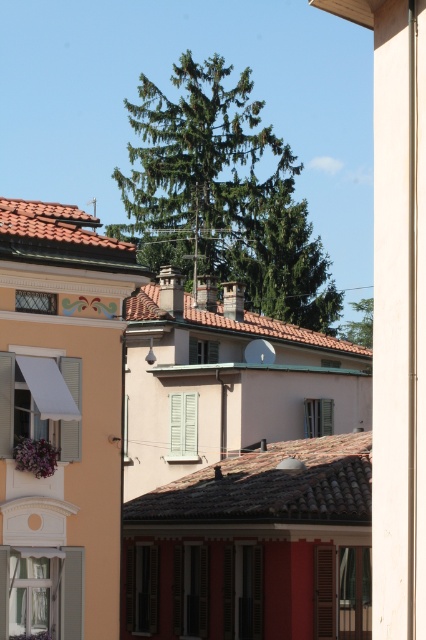
Between point (227, 204) and point (342, 333), which one is positioned behind?

Positioned behind is point (342, 333).

Can you confirm if green needle-like tree at upper center is positioned above green leafy tree at upper center?

Yes, green needle-like tree at upper center is above green leafy tree at upper center.

Which is in front, point (290, 209) or point (353, 339)?

Positioned in front is point (290, 209).

What are the coordinates of `green needle-like tree at upper center` in the screenshot? It's located at (221, 195).